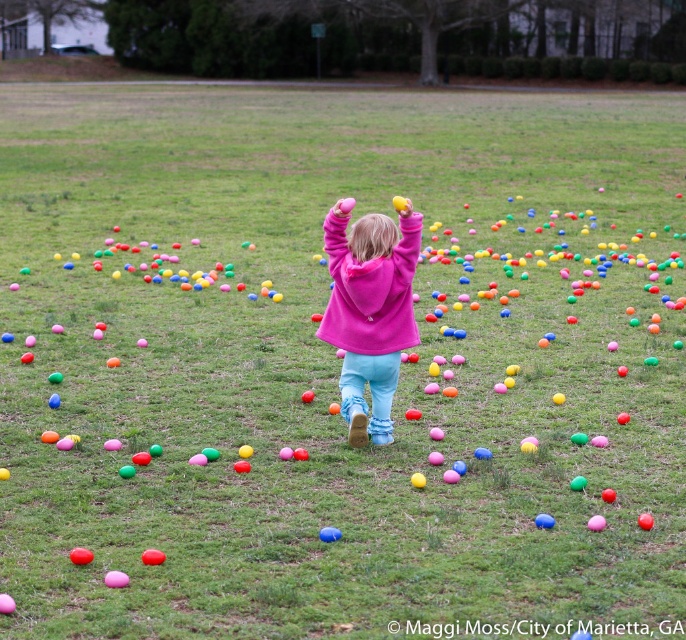
Consider the image. You are taking a photo of the scene and want to focus on the two points in the image. Which of the two points, point (145, 557) or point (322, 528), will be in sharper focus if you focus on the closer one?

Point (145, 557) is closer to the camera than point (322, 528), so focusing on the closer point will keep it in sharper focus while the other may be slightly blurred.

You are a child in the park and you want to throw both the red rubber egg at center and the blue rubber ball at center as far as you can. Which object will travel farther when thrown with the same force?

The blue rubber ball at center will travel farther than the red rubber egg at center because it is larger in size, which might mean it has more mass or surface area, potentially affecting its aerodynamics and distance traveled.